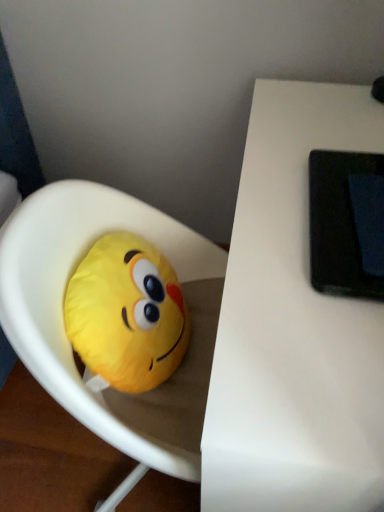
What are the coordinates of `empty space that is ontop of white matte table at upper right` in the screenshot? It's located at (311, 187).